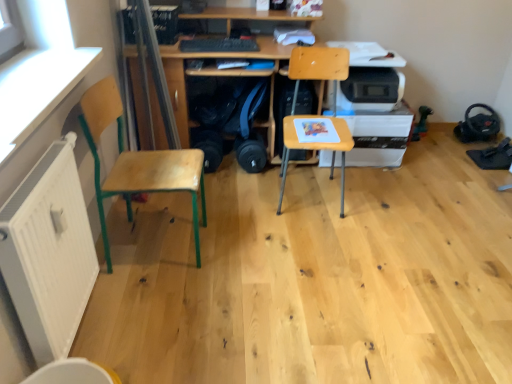
Locate an element on the screen. The image size is (512, 384). unoccupied region to the right of wooden at left, positioned as the 2th chair in right-to-left order is located at coordinates (240, 249).